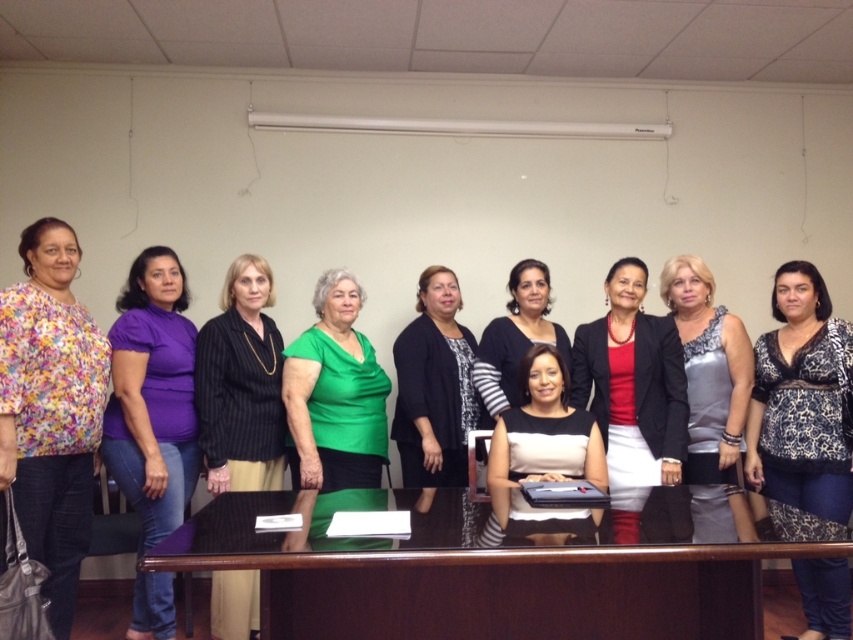
How much distance is there between black striped shirt at center and black textured dress at center?

A distance of 26.98 inches exists between black striped shirt at center and black textured dress at center.

Can you confirm if black striped shirt at center is taller than black textured dress at center?

No, black striped shirt at center is not taller than black textured dress at center.

Does point (271, 328) lie behind point (415, 369)?

Yes, it is.

Where is `black striped shirt at center`? The width and height of the screenshot is (853, 640). black striped shirt at center is located at coordinates (241, 385).

Is brown wood table at center shorter than black textured dress at center?

Yes.

Does brown wood table at center appear on the left side of black textured dress at center?

No, brown wood table at center is not to the left of black textured dress at center.

Describe the element at coordinates (477, 580) in the screenshot. This screenshot has width=853, height=640. I see `brown wood table at center` at that location.

The width and height of the screenshot is (853, 640). What are the coordinates of `brown wood table at center` in the screenshot? It's located at (477, 580).

Between black striped shirt at center and matte black blouse at center, which one has less height?

matte black blouse at center is shorter.

Based on the photo, can you confirm if black striped shirt at center is bigger than matte black blouse at center?

Correct, black striped shirt at center is larger in size than matte black blouse at center.

Is point (248, 449) less distant than point (503, 464)?

No, (248, 449) is further to viewer.

Where is `black striped shirt at center`? This screenshot has width=853, height=640. black striped shirt at center is located at coordinates (241, 385).